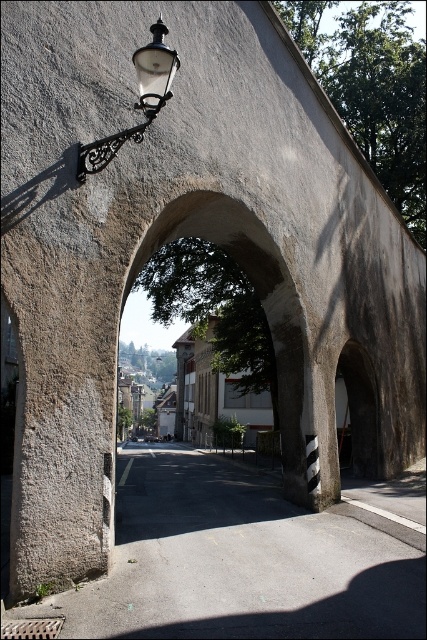
Does smooth stone archway at center have a larger size compared to matte black street light at upper left?

Yes, smooth stone archway at center is bigger than matte black street light at upper left.

The height and width of the screenshot is (640, 427). What do you see at coordinates (266, 314) in the screenshot?
I see `smooth stone archway at center` at bounding box center [266, 314].

Identify the location of smooth stone archway at center. (266, 314).

Does gray concrete alley at center have a greater height compared to matte black street light at upper left?

Indeed, gray concrete alley at center has a greater height compared to matte black street light at upper left.

Is gray concrete alley at center to the right of matte black street light at upper left from the viewer's perspective?

Indeed, gray concrete alley at center is positioned on the right side of matte black street light at upper left.

Is point (175, 484) positioned after point (148, 108)?

Yes, it is behind point (148, 108).

Find the location of a particular element. gray concrete alley at center is located at coordinates (246, 557).

Between gray concrete alley at center and smooth stone archway at center, which one has more height?

smooth stone archway at center is taller.

Is gray concrete alley at center taller than smooth stone archway at center?

In fact, gray concrete alley at center may be shorter than smooth stone archway at center.

The width and height of the screenshot is (427, 640). What do you see at coordinates (246, 557) in the screenshot?
I see `gray concrete alley at center` at bounding box center [246, 557].

Identify the location of gray concrete alley at center. The image size is (427, 640). (246, 557).